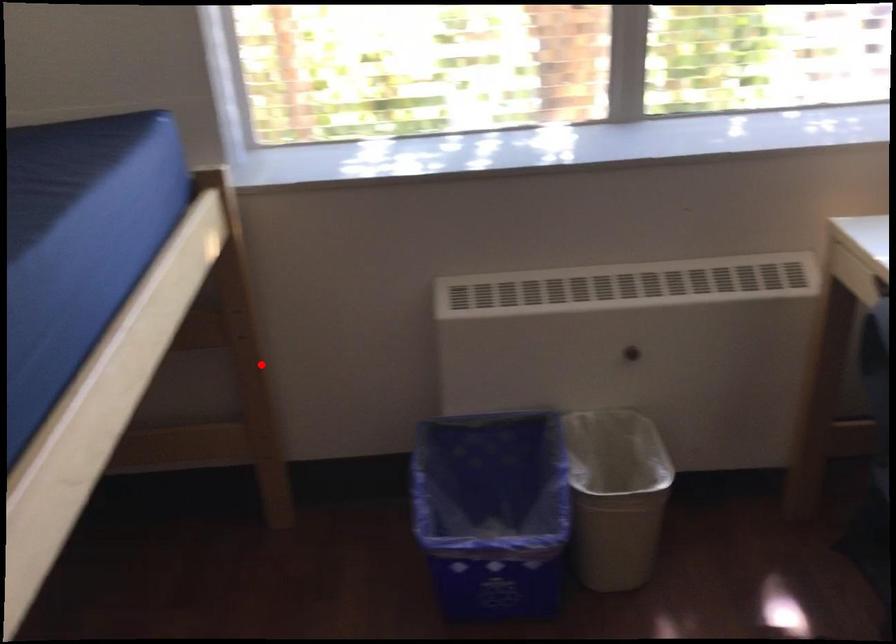
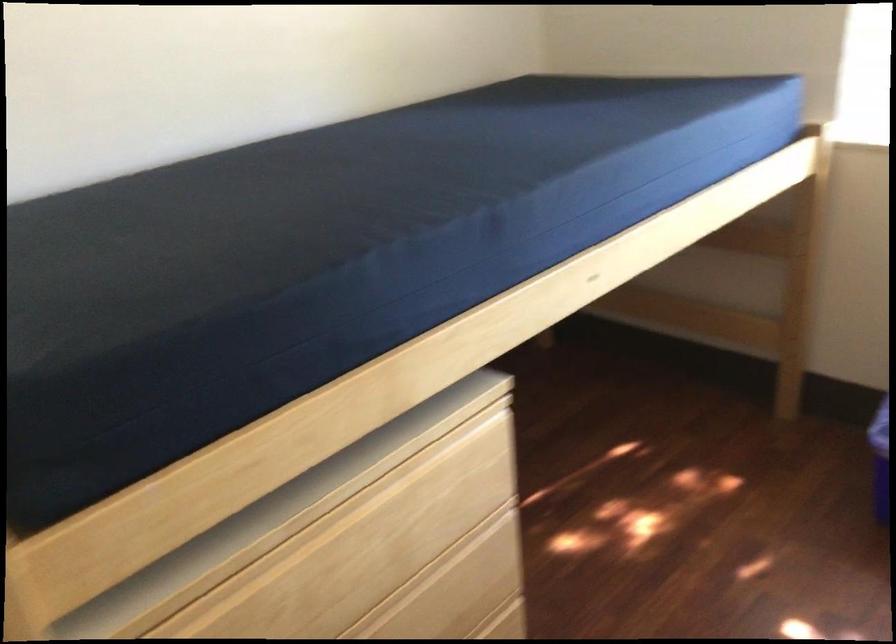
Question: A red point is marked in image1. In image2, is the corresponding 3D point closer to the camera or farther? Reply with the corresponding letter.

Choices:
 (A) The corresponding 3D point is closer.
 (B) The corresponding 3D point is farther.

Answer: (B)